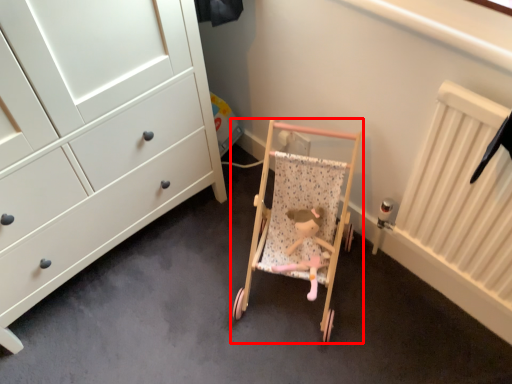
Question: From the image's perspective, what is the correct spatial relationship of furniture (annotated by the red box) in relation to toy?

Choices:
 (A) below
 (B) above

Answer: (B)